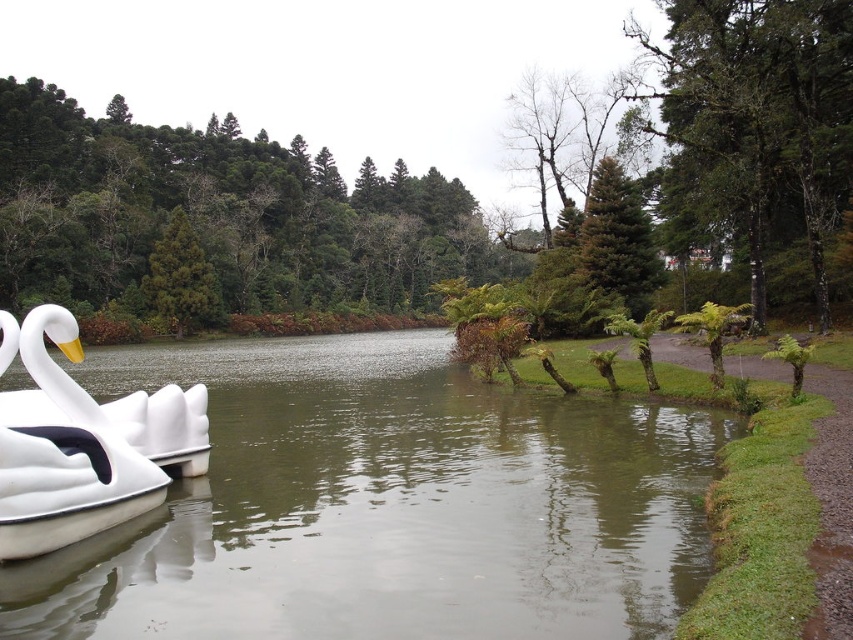
Question: Which point appears closest to the camera in this image?

Choices:
 (A) (161, 465)
 (B) (637, 476)

Answer: (B)

Question: Which object is closer to the camera taking this photo?

Choices:
 (A) green smooth water at left
 (B) white matte swan at left

Answer: (A)

Question: Can you confirm if green smooth water at left is smaller than white matte swan at left?

Choices:
 (A) yes
 (B) no

Answer: (B)

Question: Is green smooth water at left closer to the viewer compared to white matte swan at left?

Choices:
 (A) yes
 (B) no

Answer: (A)

Question: Can you confirm if green smooth water at left is positioned to the left of white matte swan at left?

Choices:
 (A) yes
 (B) no

Answer: (A)